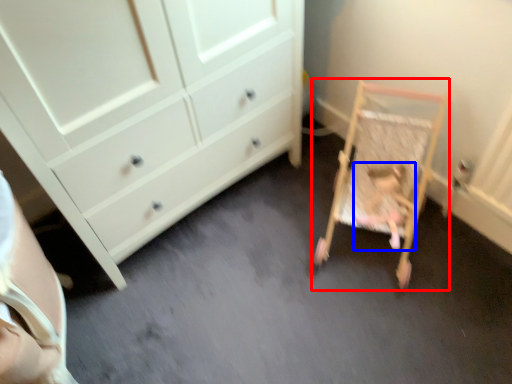
Question: Among these objects, which one is nearest to the camera, furniture (highlighted by a red box) or person (highlighted by a blue box)?

Choices:
 (A) furniture
 (B) person

Answer: (A)